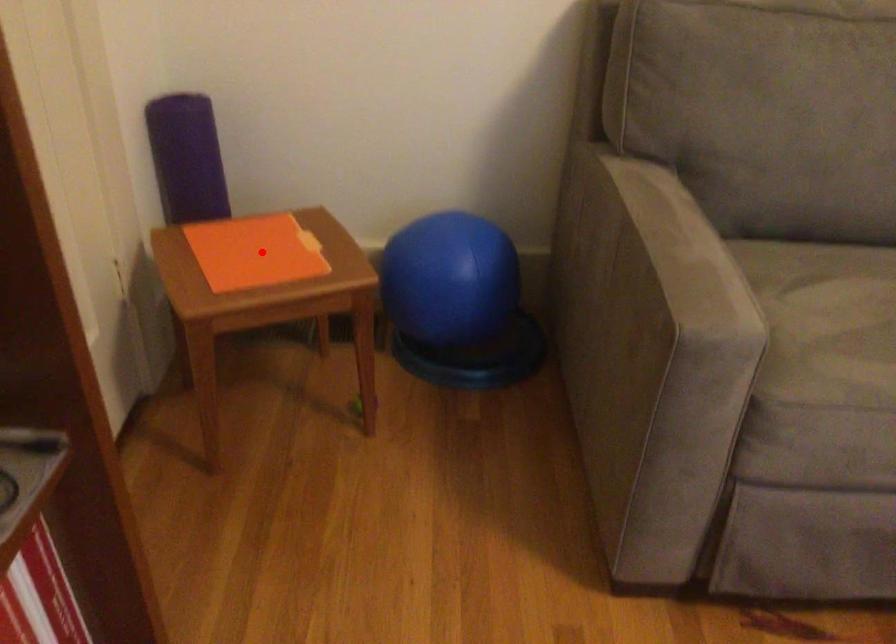
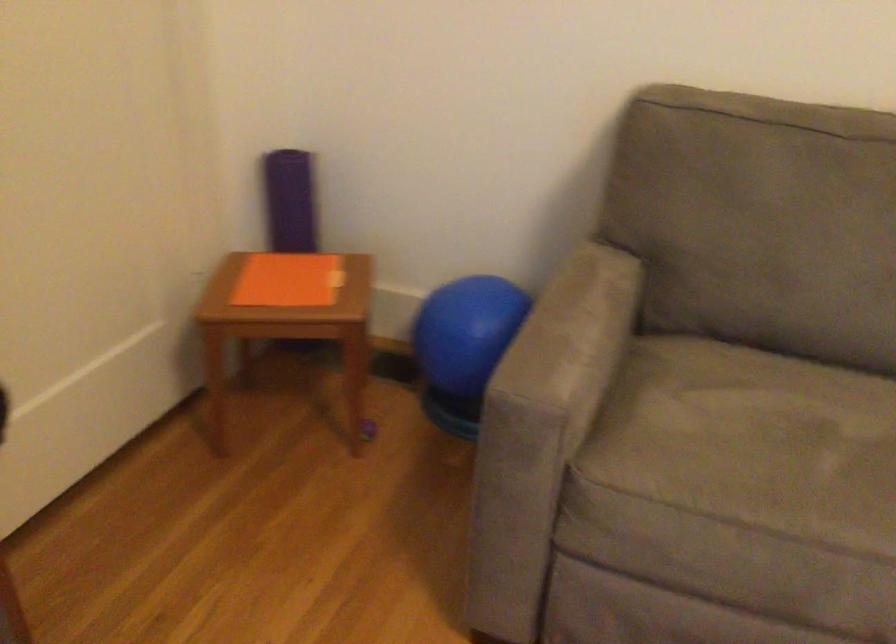
Question: I am providing you with two images of the same scene from different viewpoints. A red point is shown in image1. For the corresponding object point in image2, is it positioned nearer or farther from the camera?

Choices:
 (A) Nearer
 (B) Farther

Answer: (B)